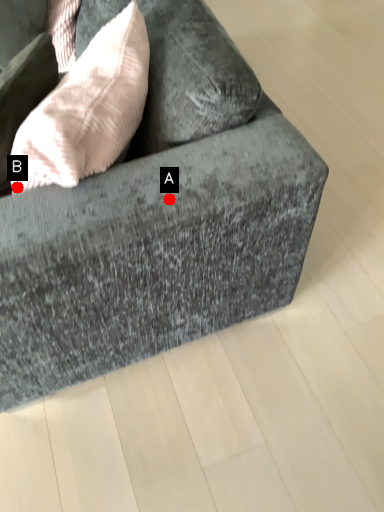
Question: Two points are circled on the image, labeled by A and B beside each circle. Which point is further to the camera?

Choices:
 (A) A is further
 (B) B is further

Answer: (B)